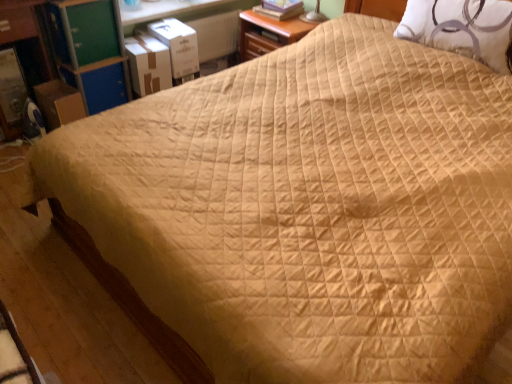
In order to click on vacant space situated above white cardboard box at upper left, the first cardboard box in the right-to-left sequence (from a real-world perspective) in this screenshot , I will do `click(170, 27)`.